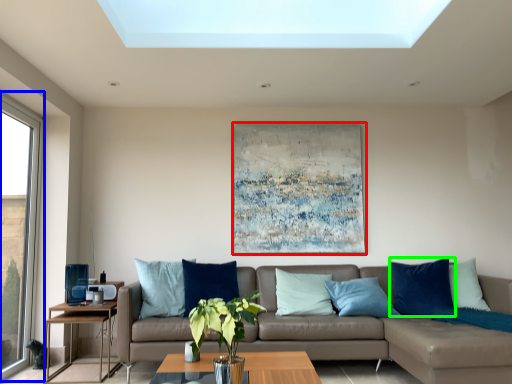
Question: Which object is the closest to the picture frame (highlighted by a red box)? Choose among these: window (highlighted by a blue box) or pillow (highlighted by a green box).

Choices:
 (A) window
 (B) pillow

Answer: (B)